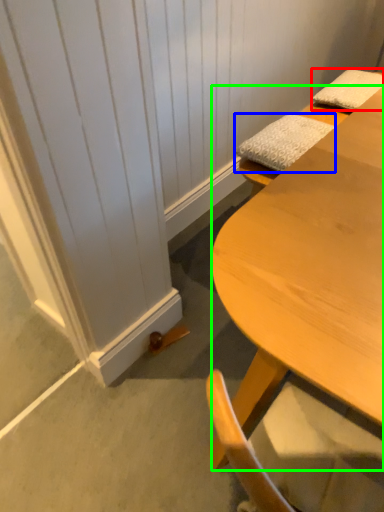
Question: Which object is the closest to the pillow (highlighted by a red box)? Choose among these: pillow (highlighted by a blue box) or desk (highlighted by a green box).

Choices:
 (A) pillow
 (B) desk

Answer: (A)